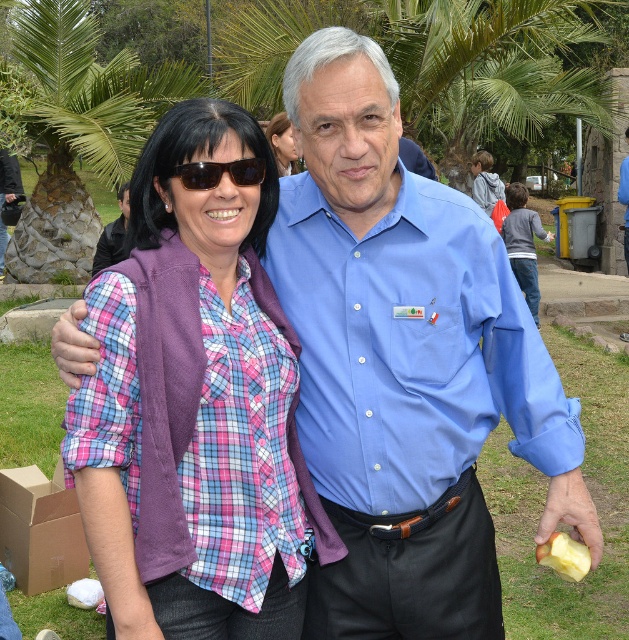
Question: Considering the real-world distances, which object is closest to the green leafy palm tree at upper left?

Choices:
 (A) sunglasses at center
 (B) matte black hair at upper center
 (C) blue cotton shirt at center
 (D) plaid fabric shirt at center

Answer: (B)

Question: Does blue cotton shirt at center have a lesser width compared to green leafy palm tree at upper left?

Choices:
 (A) yes
 (B) no

Answer: (A)

Question: Among these objects, which one is nearest to the camera?

Choices:
 (A) green leafy palm tree at upper left
 (B) blue cotton shirt at center
 (C) plaid fabric shirt at center
 (D) sunglasses at center

Answer: (C)

Question: Which point appears closest to the camera in this image?

Choices:
 (A) (118, 241)
 (B) (42, 180)
 (C) (169, 188)
 (D) (214, 176)

Answer: (D)

Question: Is plaid fabric shirt at center positioned in front of sunglasses at center?

Choices:
 (A) yes
 (B) no

Answer: (A)

Question: Can you confirm if green leafy palm tree at upper left is positioned below matte black hair at upper center?

Choices:
 (A) no
 (B) yes

Answer: (A)